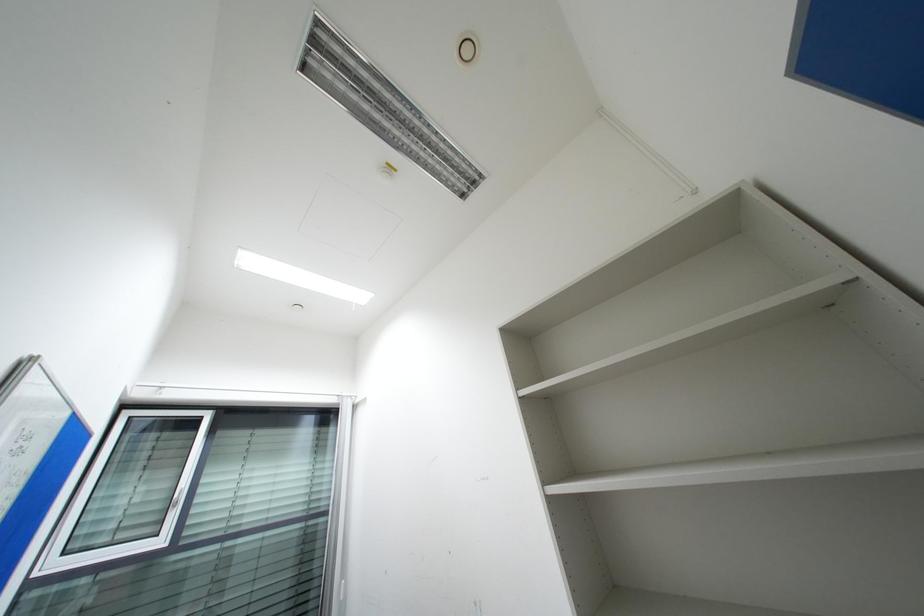
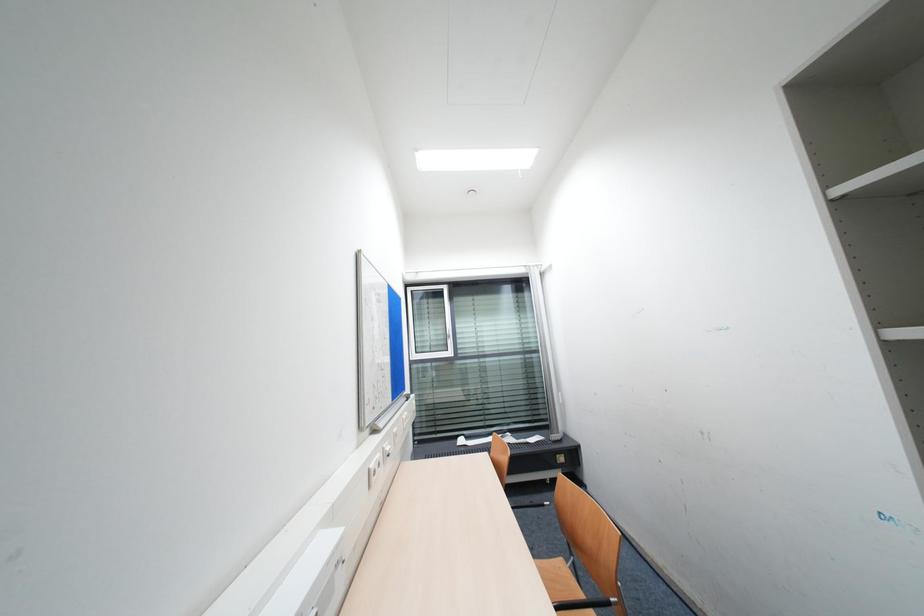
Based on the continuous images, in which direction is the camera rotating?

The camera rotated toward left-down.